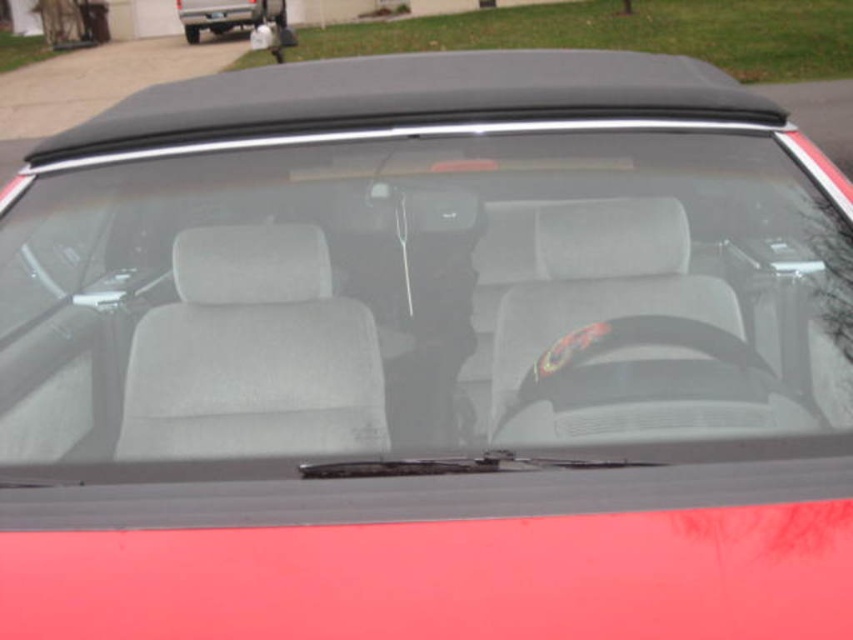
You are a passenger in the car and want to look at the convertible roof. Based on the scene, where is the gray fabric seat at center in relation to the matte black convertible at upper center?

The gray fabric seat at center is located below the matte black convertible at upper center.

You are sitting in the driver seat of the car and want to reach both points on the windshield. Which point is closer to you, point at coordinate (186, 35) or point at coordinate (224, 13)?

Point at coordinate (186, 35) is closer to you than point at coordinate (224, 13) because it is further to the camera, meaning it is physically nearer to your position in the driver seat.